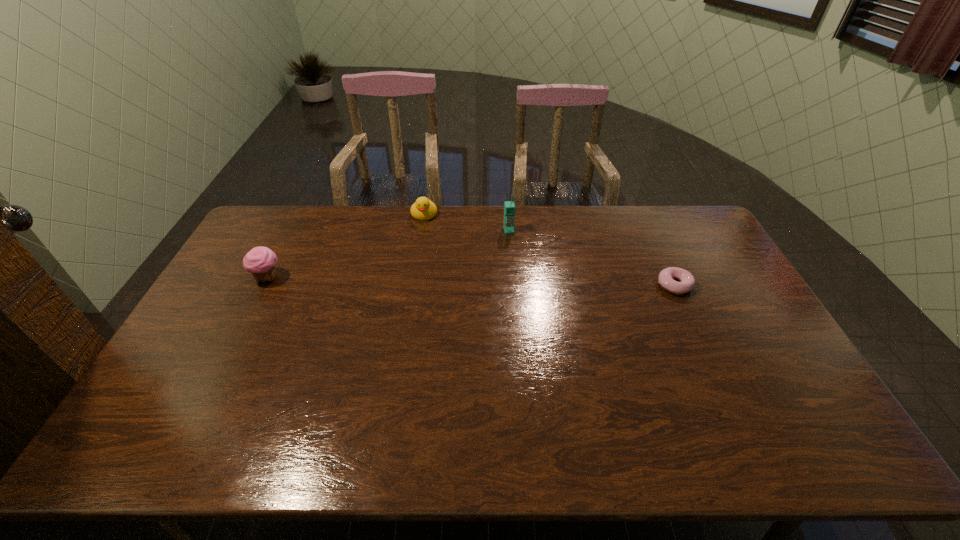
Identify the location of the leftmost object. (261, 261).

I want to click on cupcake, so click(261, 261).

Identify the location of the shortest object. (666, 277).

The height and width of the screenshot is (540, 960). What are the coordinates of `the rightmost object` in the screenshot? It's located at (666, 277).

At what (x,y) coordinates should I click in order to perform the action: click on the third object from left to right. Please return your answer as a coordinate pair (x, y). Image resolution: width=960 pixels, height=540 pixels. Looking at the image, I should click on click(509, 207).

Where is `the tallest object`? This screenshot has height=540, width=960. the tallest object is located at coordinates (509, 207).

Find the location of a particular element. This screenshot has height=540, width=960. the second object from left to right is located at coordinates 423,209.

I want to click on the second shortest object, so click(x=423, y=209).

Locate an element on the screen. vacant point located 0.240m on the front of the second tallest object is located at coordinates (231, 348).

Locate an element on the screen. The image size is (960, 540). free spot located on the front of the rightmost object is located at coordinates (731, 406).